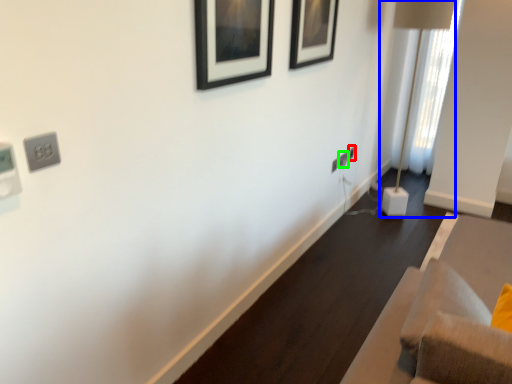
Question: Which object is positioned farthest from electric outlet (highlighted by a red box)? Select from table lamp (highlighted by a blue box) and electric outlet (highlighted by a green box).

Choices:
 (A) table lamp
 (B) electric outlet

Answer: (A)